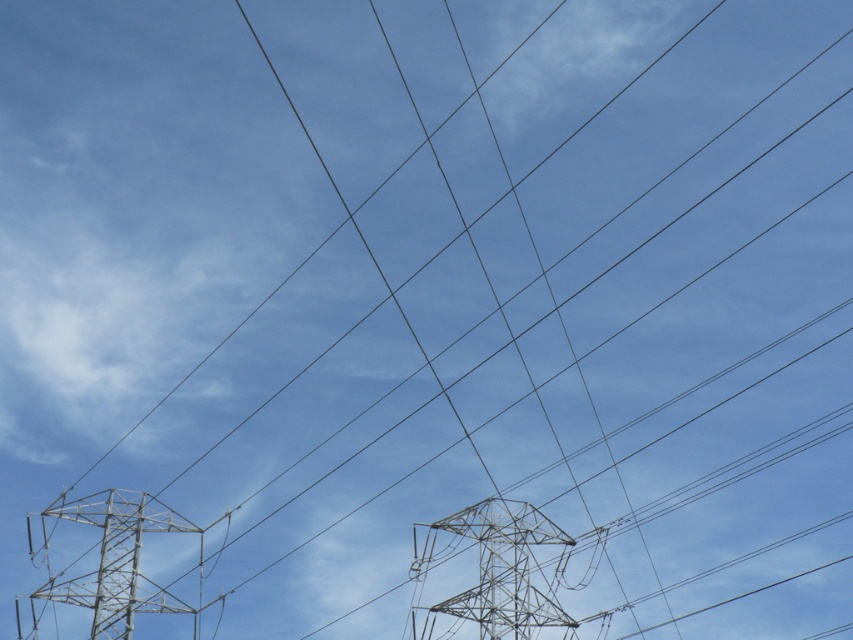
You are a maintenance worker needing to inspect both the metallic silver tower at center and the metallic silver tower at lower left. Given that your drone can travel a maximum distance of 50 meters before needing a battery recharge, will you be able to inspect both towers without recharging?

The metallic silver tower at center and the metallic silver tower at lower left are 53.89 meters apart from each other. Since the drone can only travel up to 50 meters before recharging, you will not be able to inspect both towers without recharging the drone first.

You are an engineer assessing the structural integrity of the power lines. You observe the metallic silver tower at center and the metallic silver tower at lower left. Which tower would require more frequent maintenance checks due to its size and potential load distribution?

The metallic silver tower at lower left requires more frequent maintenance checks because it occupies more space than the metallic silver tower at center, which may mean it supports more weight and requires closer monitoring.